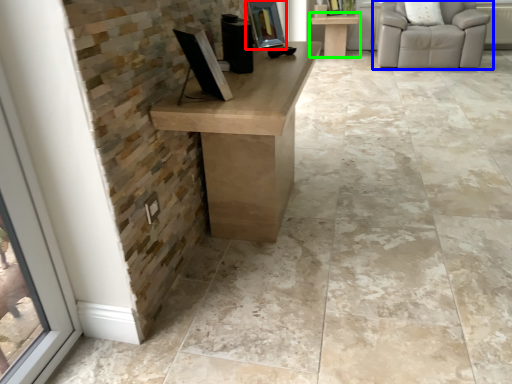
Question: Considering the real-world distances, which object is closest to picture frame (highlighted by a red box)? chair (highlighted by a blue box) or table (highlighted by a green box).

Choices:
 (A) chair
 (B) table

Answer: (A)